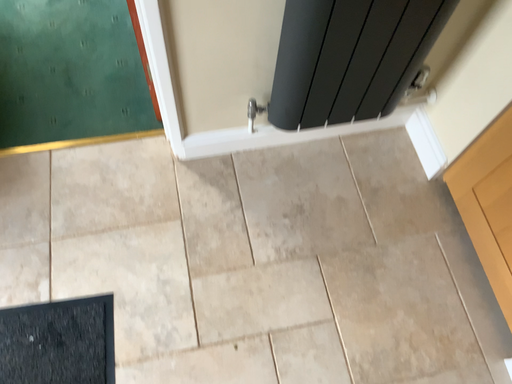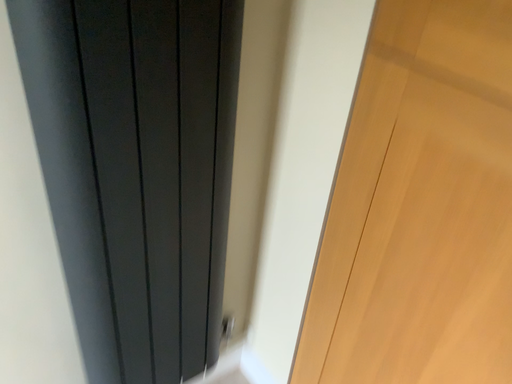
Question: Which way did the camera rotate in the video?

Choices:
 (A) rotated left
 (B) rotated right

Answer: (B)